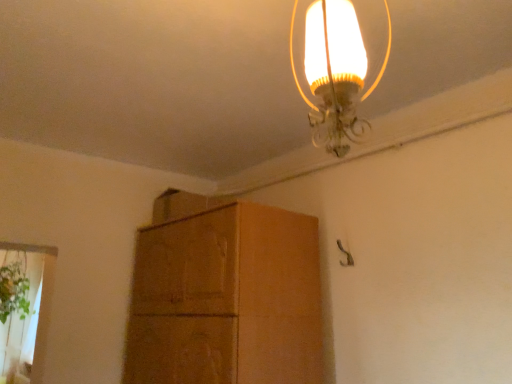
Describe the element at coordinates (14, 290) in the screenshot. Image resolution: width=512 pixels, height=384 pixels. I see `green leafy plant at lower left` at that location.

Image resolution: width=512 pixels, height=384 pixels. What do you see at coordinates (331, 94) in the screenshot?
I see `translucent glass lampshade at upper center` at bounding box center [331, 94].

The height and width of the screenshot is (384, 512). What do you see at coordinates (227, 300) in the screenshot? I see `brown cardboard cabinet at center` at bounding box center [227, 300].

Identify the location of green leafy plant at lower left. (14, 290).

Considering the relative sizes of brown cardboard cabinet at center and translucent glass lampshade at upper center in the image provided, is brown cardboard cabinet at center bigger than translucent glass lampshade at upper center?

Yes.

The width and height of the screenshot is (512, 384). I want to click on cabinetry that appears below the translucent glass lampshade at upper center (from the image's perspective), so click(x=227, y=300).

Consider the image. Can you confirm if brown cardboard cabinet at center is wider than translucent glass lampshade at upper center?

Indeed, brown cardboard cabinet at center has a greater width compared to translucent glass lampshade at upper center.

Is translucent glass lampshade at upper center next to green leafy plant at lower left and touching it?

No.

Can you tell me how much translucent glass lampshade at upper center and green leafy plant at lower left differ in facing direction?

The facing directions of translucent glass lampshade at upper center and green leafy plant at lower left are 1.89 degrees apart.

Which of these two, translucent glass lampshade at upper center or green leafy plant at lower left, stands taller?

green leafy plant at lower left is taller.

Considering the positions of objects translucent glass lampshade at upper center and green leafy plant at lower left in the image provided, who is more to the right, translucent glass lampshade at upper center or green leafy plant at lower left?

translucent glass lampshade at upper center is more to the right.

Would you say translucent glass lampshade at upper center is a long distance from brown cardboard cabinet at center?

Yes, translucent glass lampshade at upper center and brown cardboard cabinet at center are located far from each other.

Considering the points (318, 130) and (141, 270), which point is behind, point (318, 130) or point (141, 270)?

The point (141, 270) is more distant.

Considering the relative sizes of translucent glass lampshade at upper center and brown cardboard cabinet at center in the image provided, is translucent glass lampshade at upper center wider than brown cardboard cabinet at center?

Incorrect, the width of translucent glass lampshade at upper center does not surpass that of brown cardboard cabinet at center.

Image resolution: width=512 pixels, height=384 pixels. Identify the location of lamp above the brown cardboard cabinet at center (from a real-world perspective). (331, 94).

Is green leafy plant at lower left shorter than translucent glass lampshade at upper center?

No.

Can you tell me how much green leafy plant at lower left and translucent glass lampshade at upper center differ in facing direction?

The facing directions of green leafy plant at lower left and translucent glass lampshade at upper center are 1.89 degrees apart.

Which object is positioned more to the left, green leafy plant at lower left or translucent glass lampshade at upper center?

green leafy plant at lower left is more to the left.

Can we say green leafy plant at lower left lies outside translucent glass lampshade at upper center?

Yes, green leafy plant at lower left is outside of translucent glass lampshade at upper center.

Choose the correct answer: Is brown cardboard cabinet at center inside green leafy plant at lower left or outside it?

brown cardboard cabinet at center is not enclosed by green leafy plant at lower left.

From the image's perspective, is brown cardboard cabinet at center on top of green leafy plant at lower left?

Yes, from the image's perspective, brown cardboard cabinet at center is above green leafy plant at lower left.

Which of these two, brown cardboard cabinet at center or green leafy plant at lower left, is wider?

With larger width is green leafy plant at lower left.

Is brown cardboard cabinet at center looking in the opposite direction of green leafy plant at lower left?

brown cardboard cabinet at center does not have its back to green leafy plant at lower left.

Is green leafy plant at lower left in front of or behind brown cardboard cabinet at center in the image?

Visually, green leafy plant at lower left is located behind brown cardboard cabinet at center.

Can you tell me how much green leafy plant at lower left and brown cardboard cabinet at center differ in facing direction?

There is a 89.9-degree angle between the facing directions of green leafy plant at lower left and brown cardboard cabinet at center.

In order to click on cabinetry in front of the green leafy plant at lower left in this screenshot , I will do `click(227, 300)`.

Considering the sizes of green leafy plant at lower left and brown cardboard cabinet at center in the image, is green leafy plant at lower left taller or shorter than brown cardboard cabinet at center?

Considering their sizes, green leafy plant at lower left has less height than brown cardboard cabinet at center.

This screenshot has width=512, height=384. Identify the location of cabinetry on the left side of translucent glass lampshade at upper center. (227, 300).

This screenshot has height=384, width=512. There is a green leafy plant at lower left. What are the coordinates of `lamp above it (from a real-world perspective)` in the screenshot? It's located at (331, 94).

Based on their spatial positions, is translucent glass lampshade at upper center or green leafy plant at lower left closer to brown cardboard cabinet at center?

green leafy plant at lower left lies closer to brown cardboard cabinet at center than the other object.

Looking at this image, estimate the real-world distances between objects in this image. Which object is closer to brown cardboard cabinet at center, green leafy plant at lower left or translucent glass lampshade at upper center?

The object closer to brown cardboard cabinet at center is green leafy plant at lower left.

When comparing their distances from translucent glass lampshade at upper center, does green leafy plant at lower left or brown cardboard cabinet at center seem further?

Based on the image, green leafy plant at lower left appears to be further to translucent glass lampshade at upper center.

Estimate the real-world distances between objects in this image. Which object is further from green leafy plant at lower left, translucent glass lampshade at upper center or brown cardboard cabinet at center?

The object further to green leafy plant at lower left is translucent glass lampshade at upper center.

Looking at the image, which one is located closer to green leafy plant at lower left, brown cardboard cabinet at center or translucent glass lampshade at upper center?

The object closer to green leafy plant at lower left is brown cardboard cabinet at center.

Looking at the image, which one is located further to translucent glass lampshade at upper center, brown cardboard cabinet at center or green leafy plant at lower left?

green leafy plant at lower left is further to translucent glass lampshade at upper center.

The width and height of the screenshot is (512, 384). I want to click on cabinetry between translucent glass lampshade at upper center and green leafy plant at lower left along the z-axis, so click(227, 300).